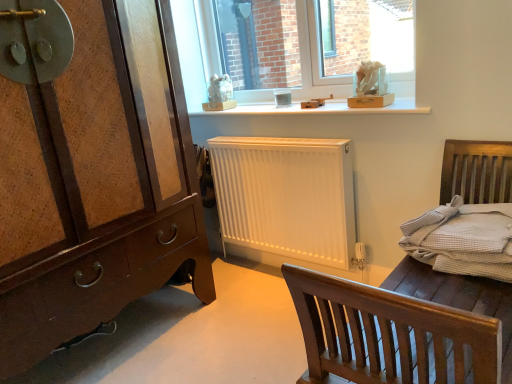
Question: From a real-world perspective, is brown wood chest of drawers at left on white matte bed frame at center?

Choices:
 (A) yes
 (B) no

Answer: (A)

Question: From the image's perspective, is brown wood chest of drawers at left over white matte bed frame at center?

Choices:
 (A) no
 (B) yes

Answer: (B)

Question: Does brown wood chest of drawers at left have a lesser height compared to white matte bed frame at center?

Choices:
 (A) no
 (B) yes

Answer: (A)

Question: Is brown wood chest of drawers at left not near white matte bed frame at center?

Choices:
 (A) no
 (B) yes

Answer: (B)

Question: Does brown wood chest of drawers at left appear on the right side of white matte bed frame at center?

Choices:
 (A) no
 (B) yes

Answer: (A)

Question: From a real-world perspective, is brown wood chest of drawers at left located beneath white matte bed frame at center?

Choices:
 (A) no
 (B) yes

Answer: (A)

Question: Is brown wood chest of drawers at left positioned before light gray woven bedding at right?

Choices:
 (A) no
 (B) yes

Answer: (B)

Question: From the image's perspective, is brown wood chest of drawers at left beneath light gray woven bedding at right?

Choices:
 (A) yes
 (B) no

Answer: (B)

Question: Is brown wood chest of drawers at left to the right of light gray woven bedding at right from the viewer's perspective?

Choices:
 (A) yes
 (B) no

Answer: (B)

Question: Is brown wood chest of drawers at left outside light gray woven bedding at right?

Choices:
 (A) no
 (B) yes

Answer: (B)

Question: Are brown wood chest of drawers at left and light gray woven bedding at right far apart?

Choices:
 (A) no
 (B) yes

Answer: (B)

Question: From the image's perspective, is brown wood chest of drawers at left on top of light gray woven bedding at right?

Choices:
 (A) no
 (B) yes

Answer: (B)

Question: From a real-world perspective, does white matte bed frame at center sit lower than white wooden shelf at upper center?

Choices:
 (A) no
 (B) yes

Answer: (B)